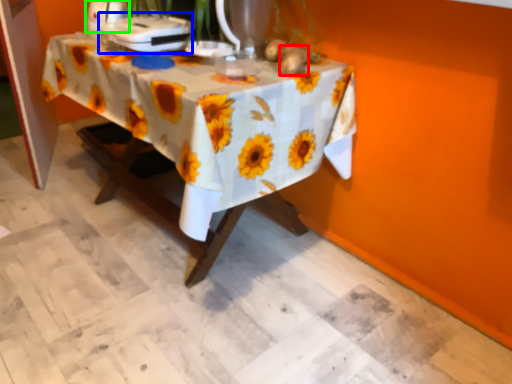
Question: Which is nearer to the flower (highlighted by a red box)? appliance (highlighted by a blue box) or appliance (highlighted by a green box).

Choices:
 (A) appliance
 (B) appliance

Answer: (A)